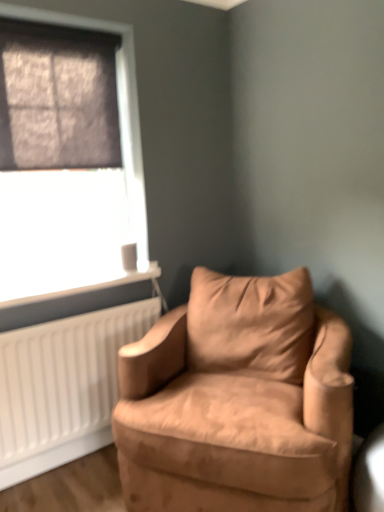
Question: Can you confirm if matte black window at upper left is shorter than white plastic radiator at lower left?

Choices:
 (A) yes
 (B) no

Answer: (B)

Question: Does matte black window at upper left have a smaller size compared to white plastic radiator at lower left?

Choices:
 (A) no
 (B) yes

Answer: (A)

Question: Would you say matte black window at upper left is outside white plastic radiator at lower left?

Choices:
 (A) yes
 (B) no

Answer: (A)

Question: Does matte black window at upper left have a lesser width compared to white plastic radiator at lower left?

Choices:
 (A) yes
 (B) no

Answer: (A)

Question: Can you confirm if matte black window at upper left is wider than white plastic radiator at lower left?

Choices:
 (A) yes
 (B) no

Answer: (B)

Question: Is suede-like tan armchair at center inside the boundaries of white plastic radiator at lower left, or outside?

Choices:
 (A) inside
 (B) outside

Answer: (B)

Question: Considering the positions of suede-like tan armchair at center and white plastic radiator at lower left in the image, is suede-like tan armchair at center taller or shorter than white plastic radiator at lower left?

Choices:
 (A) tall
 (B) short

Answer: (A)

Question: In the image, is suede-like tan armchair at center positioned in front of or behind white plastic radiator at lower left?

Choices:
 (A) front
 (B) behind

Answer: (A)

Question: Considering the positions of suede-like tan armchair at center and white plastic radiator at lower left in the image, is suede-like tan armchair at center wider or thinner than white plastic radiator at lower left?

Choices:
 (A) thin
 (B) wide

Answer: (B)

Question: Considering the positions of suede-like tan armchair at center and matte black window at upper left in the image, is suede-like tan armchair at center wider or thinner than matte black window at upper left?

Choices:
 (A) wide
 (B) thin

Answer: (A)

Question: Is suede-like tan armchair at center bigger or smaller than matte black window at upper left?

Choices:
 (A) big
 (B) small

Answer: (A)

Question: From a real-world perspective, is suede-like tan armchair at center positioned above or below matte black window at upper left?

Choices:
 (A) above
 (B) below

Answer: (B)

Question: Which is correct: suede-like tan armchair at center is inside matte black window at upper left, or outside of it?

Choices:
 (A) inside
 (B) outside

Answer: (B)

Question: From the image's perspective, is suede-like tan armchair at center positioned above or below dark matte window screen at upper left?

Choices:
 (A) below
 (B) above

Answer: (A)

Question: Considering the positions of suede-like tan armchair at center and dark matte window screen at upper left in the image, is suede-like tan armchair at center wider or thinner than dark matte window screen at upper left?

Choices:
 (A) wide
 (B) thin

Answer: (A)